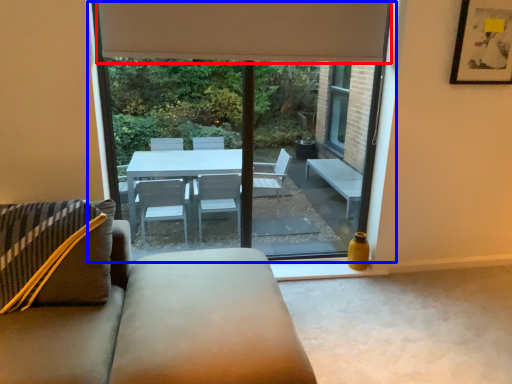
Question: Which of the following is the closest to the observer, curtain (highlighted by a red box) or window (highlighted by a blue box)?

Choices:
 (A) curtain
 (B) window

Answer: (A)